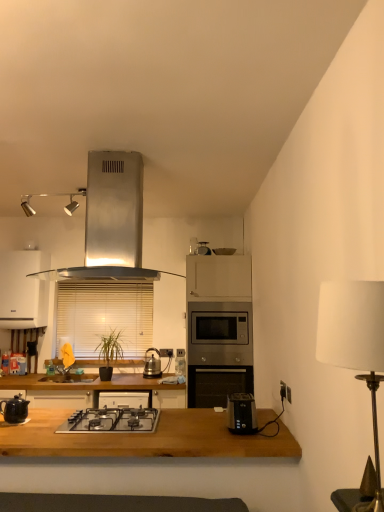
Locate an element on the screen. This screenshot has height=512, width=384. free spot in front of black plastic toaster at lower center is located at coordinates coord(239,436).